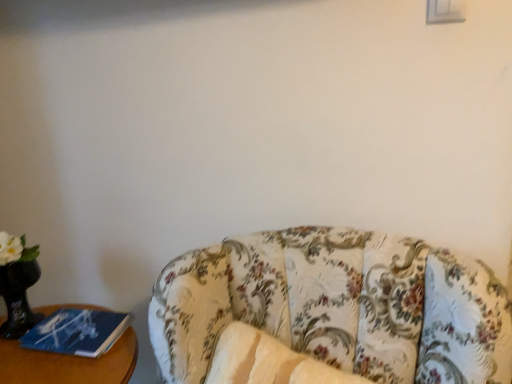
You are a GUI agent. You are given a task and a screenshot of the screen. Output one action in this format:
    pyautogui.click(x=<x>, y=<y>)
    Task: Click on the free point above blue paper at left (from a real-world perspective)
    Image resolution: width=512 pixels, height=384 pixels.
    Given the screenshot: What is the action you would take?
    pyautogui.click(x=72, y=323)